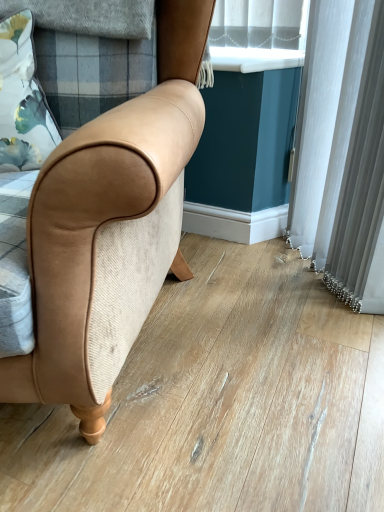
Question: Is floral fabric pillow at upper left outside of tan leather chair at center?

Choices:
 (A) yes
 (B) no

Answer: (B)

Question: Are floral fabric pillow at upper left and tan leather chair at center far apart?

Choices:
 (A) yes
 (B) no

Answer: (B)

Question: Considering the relative sizes of floral fabric pillow at upper left and tan leather chair at center in the image provided, is floral fabric pillow at upper left taller than tan leather chair at center?

Choices:
 (A) no
 (B) yes

Answer: (A)

Question: Can you confirm if floral fabric pillow at upper left is smaller than tan leather chair at center?

Choices:
 (A) no
 (B) yes

Answer: (B)

Question: Does floral fabric pillow at upper left have a lesser height compared to tan leather chair at center?

Choices:
 (A) yes
 (B) no

Answer: (A)

Question: From the image's perspective, is white plastic window sill at upper center positioned above or below tan leather chair at center?

Choices:
 (A) above
 (B) below

Answer: (A)

Question: Considering the relative positions of white plastic window sill at upper center and tan leather chair at center in the image provided, is white plastic window sill at upper center to the left or to the right of tan leather chair at center?

Choices:
 (A) right
 (B) left

Answer: (A)

Question: Is point (294, 66) positioned closer to the camera than point (162, 253)?

Choices:
 (A) closer
 (B) farther

Answer: (B)

Question: From their relative heights in the image, would you say white plastic window sill at upper center is taller or shorter than tan leather chair at center?

Choices:
 (A) tall
 (B) short

Answer: (B)

Question: Is floral fabric pillow at upper left to the left or to the right of tan leather chair at center in the image?

Choices:
 (A) right
 (B) left

Answer: (A)

Question: From a real-world perspective, relative to tan leather chair at center, is floral fabric pillow at upper left vertically above or below?

Choices:
 (A) below
 (B) above

Answer: (B)

Question: From the image's perspective, is floral fabric pillow at upper left located above or below tan leather chair at center?

Choices:
 (A) above
 (B) below

Answer: (A)

Question: Is point pos(6,56) positioned closer to the camera than point pos(54,234)?

Choices:
 (A) farther
 (B) closer

Answer: (A)

Question: Is floral fabric pillow at upper left wider or thinner than white plastic window sill at upper center?

Choices:
 (A) wide
 (B) thin

Answer: (B)

Question: Considering the positions of floral fabric pillow at upper left and white plastic window sill at upper center in the image, is floral fabric pillow at upper left bigger or smaller than white plastic window sill at upper center?

Choices:
 (A) small
 (B) big

Answer: (B)